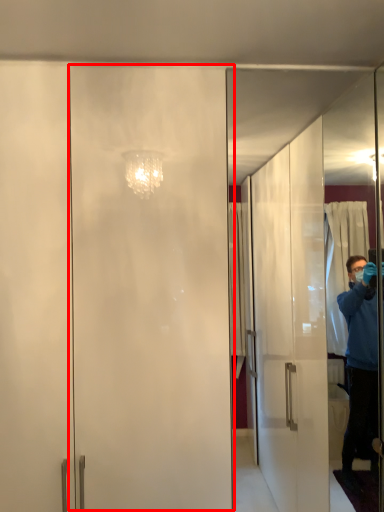
Question: From the image's perspective, where is screen door (annotated by the red box) located relative to screen door?

Choices:
 (A) below
 (B) above

Answer: (A)